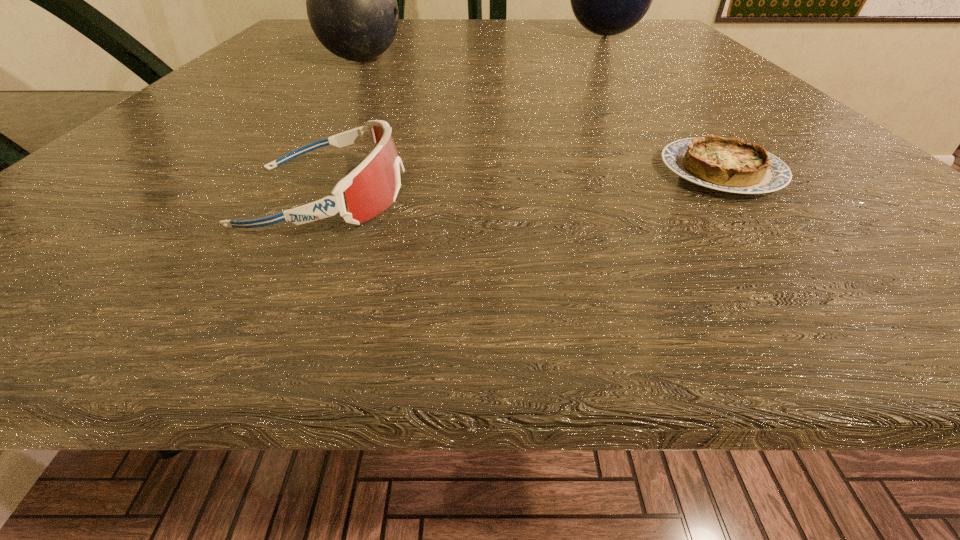
Locate an element on the screen. The image size is (960, 540). vacant region at the left edge of the desktop is located at coordinates (269, 60).

Where is `free spot at the right edge of the desktop`? The image size is (960, 540). free spot at the right edge of the desktop is located at coordinates (768, 199).

Identify the location of vacant region at the far right corner of the desktop. [607, 42].

Where is `free point at the near right corner`? This screenshot has height=540, width=960. free point at the near right corner is located at coordinates (861, 242).

In order to click on free spot between the second shortest object and the shortest object in this screenshot , I will do `click(523, 184)`.

Where is `free spot between the shortest object and the right bowling ball`? free spot between the shortest object and the right bowling ball is located at coordinates (662, 103).

This screenshot has height=540, width=960. In order to click on free space between the third tallest object and the left bowling ball in this screenshot , I will do click(344, 128).

The width and height of the screenshot is (960, 540). What are the coordinates of `free spot between the second shortest object and the farther bowling ball` in the screenshot? It's located at (465, 116).

Where is `free space between the quiche and the second farthest object`? free space between the quiche and the second farthest object is located at coordinates (541, 116).

This screenshot has height=540, width=960. I want to click on vacant area that lies between the farther bowling ball and the second shortest object, so click(465, 116).